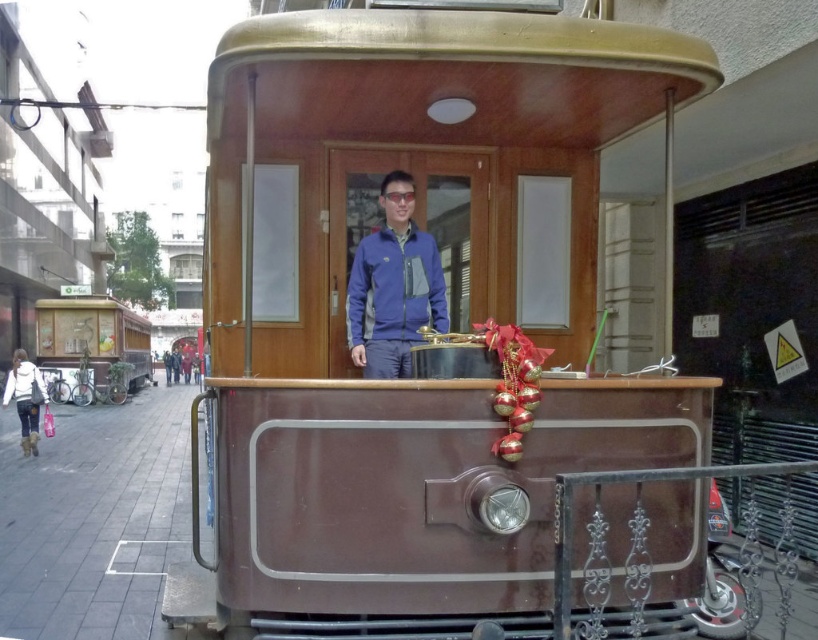
You are holding a camera and want to take a photo of the brown polished wood train at center. If you are standing 3 meters away from the train, will you be able to capture the entire train in your photo without moving closer?

The distance between you and the brown polished wood train at center is 2.99 meters, which is just under 3 meters. Since you are slightly closer than 3 meters, you should be able to capture the entire train in your photo without needing to move closer.

You are a passenger on the vintage tram and need to place a rectangular box that is 1 meter wide between the blue fleece jacket at center and the wooden cart at left. Can you fit the box between them based on their widths?

The blue fleece jacket at center has a lesser width compared to wooden cart at left. Since the box is 1 meter wide, you need to check if the space between them is at least 1 meter. However, the description only provides information about their widths, not the distance between them. Therefore, it is impossible to determine if the box will fit based on the given information.

You are a passenger on the vintage tram and want to sit as close as possible to the blue fleece jacket at center. Where should you sit?

The blue fleece jacket at center is located at point 0.482 on the y axis, so you should sit in the seat closest to that coordinate to be as close as possible.